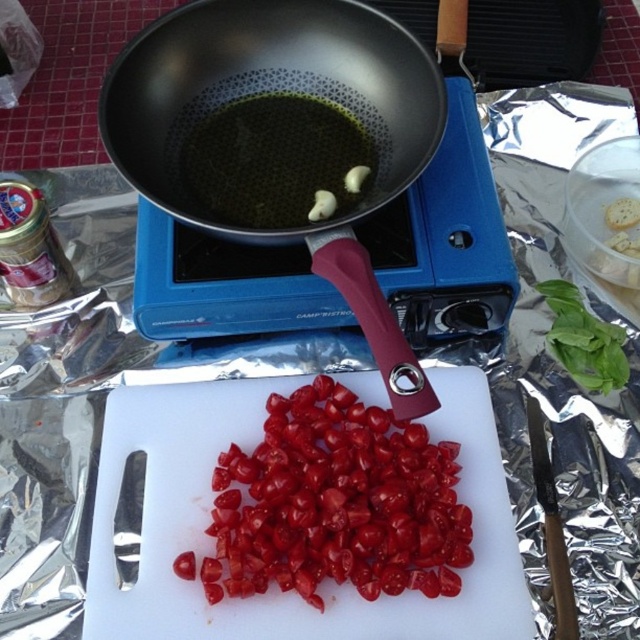
You are holding a 24 inch ruler and want to measure the distance from your eyes to the point at coordinates point (291,230). Can you reach it with the ruler?

The point at coordinates point (291,230) is 25.54 inches from the viewer. Since the ruler is only 24 inches long, you cannot reach it with the ruler.